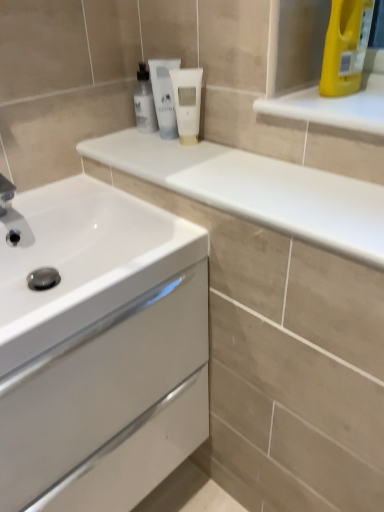
Question: Is white glossy mouthwash at upper center, the 3th mouthwash from the right, in front of or behind white matte tube at center, which appears as the second mouthwash when viewed from the right, in the image?

Choices:
 (A) behind
 (B) front

Answer: (A)

Question: From the image's perspective, relative to white matte tube at center, acting as the 2th mouthwash starting from the left, is white glossy mouthwash at upper center, acting as the 1th mouthwash starting from the left, above or below?

Choices:
 (A) below
 (B) above

Answer: (B)

Question: Which is farther from the white glossy countertop at upper center?

Choices:
 (A) white glossy cabinet at lower left
 (B) white matte tube at center, acting as the 2th mouthwash starting from the left
 (C) brushed metal faucet at left
 (D) white glossy mouthwash at upper center, the 3th mouthwash from the right
 (E) white matte tube at center, the first mouthwash from the right

Answer: (C)

Question: Which object is the closest to the white matte tube at center, the first mouthwash from the right?

Choices:
 (A) white glossy countertop at upper center
 (B) white glossy cabinet at lower left
 (C) white matte tube at center, which appears as the second mouthwash when viewed from the right
 (D) brushed metal faucet at left
 (E) white glossy mouthwash at upper center, the 3th mouthwash from the right

Answer: (C)